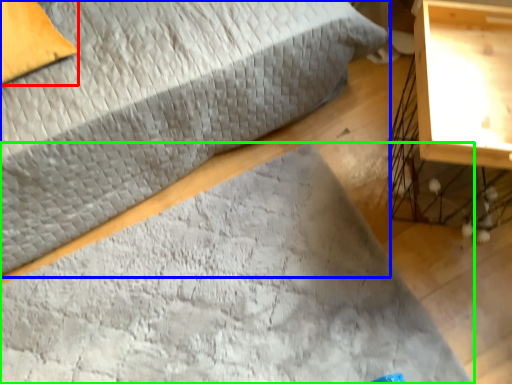
Question: Estimate the real-world distances between objects in this image. Which object is closer to pillow (highlighted by a red box), bed (highlighted by a blue box) or mat (highlighted by a green box)?

Choices:
 (A) bed
 (B) mat

Answer: (A)